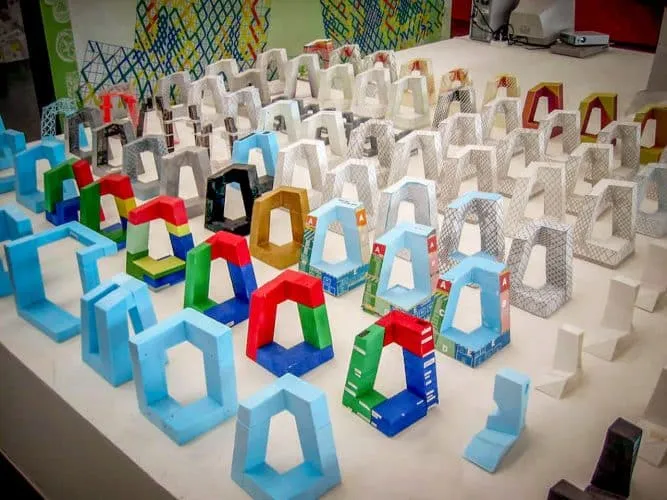
The image size is (667, 500). I want to click on space above table, so click(299, 11).